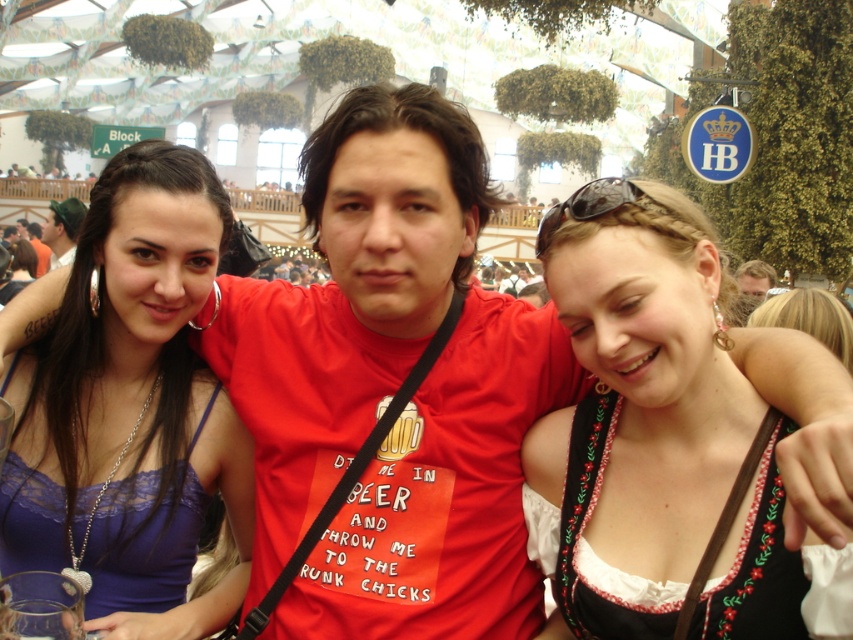
You are standing at the entrance of the beer hall and want to greet the two people at the left side of the image. The lace fabric dress at left and the matte black hair at left are your targets. If you walk straight towards them, will you reach both at the same time?

The lace fabric dress at left is 202.97 feet away from matte black hair at left, so you will reach both at the same time since they are at the same distance from your starting point.

You are organizing a charity event and need to display two dresses in a showcase. The matte purple dress at center and the lace fabric dress at left must be placed side by side. Given their sizes, which dress should be placed on the left side to ensure they fit properly in the showcase?

The lace fabric dress at left should be placed on the left side since it is smaller in size than the matte purple dress at center, allowing both dresses to fit properly in the showcase.